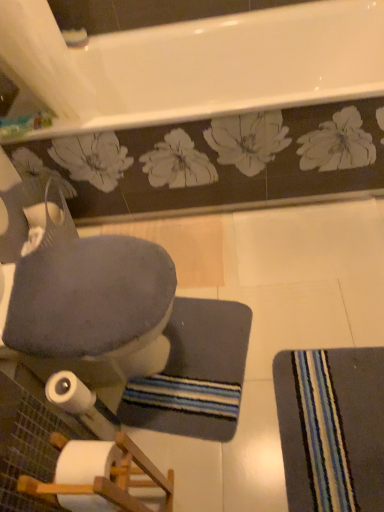
Question: Considering their positions, is striped fabric mat at lower right located in front of or behind velvet gray rocking chair at lower left?

Choices:
 (A) behind
 (B) front

Answer: (A)

Question: Do you think striped fabric mat at lower right is within velvet gray rocking chair at lower left, or outside of it?

Choices:
 (A) outside
 (B) inside

Answer: (A)

Question: Which object is the farthest from the striped fabric mat at lower right?

Choices:
 (A) dark gray textured bath mat at center
 (B) white matte toilet paper at lower left
 (C) velvet gray rocking chair at lower left

Answer: (B)

Question: Estimate the real-world distances between objects in this image. Which object is farther from the dark gray textured bath mat at center?

Choices:
 (A) white matte toilet paper at lower left
 (B) striped fabric mat at lower right
 (C) velvet gray rocking chair at lower left

Answer: (A)